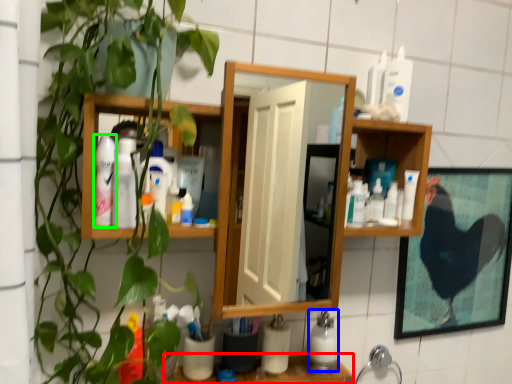
Question: Which is nearer to the counter top (highlighted by a red box)? cleaning product (highlighted by a blue box) or toiletry (highlighted by a green box).

Choices:
 (A) cleaning product
 (B) toiletry

Answer: (A)